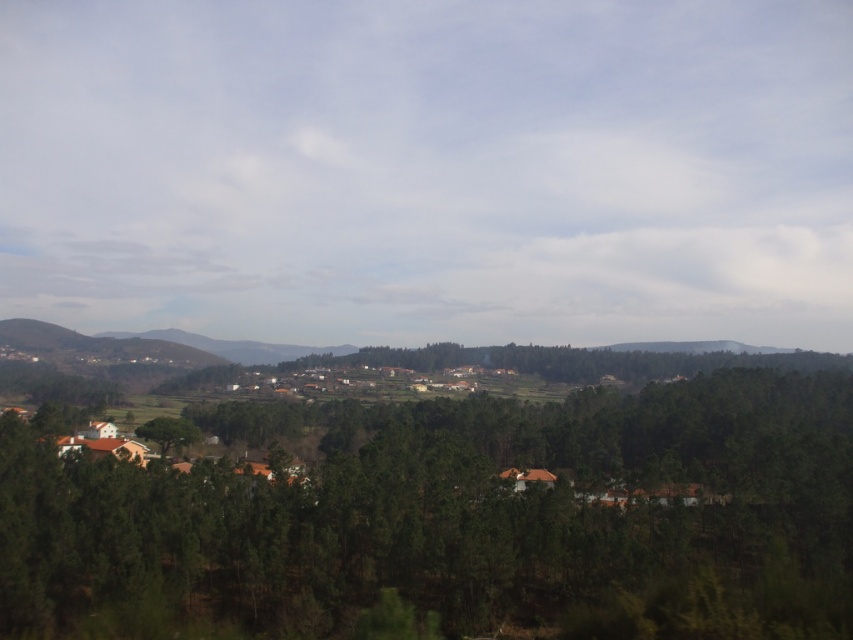
You are an environmental scientist assessing the landscape. You need to determine which object occupies more horizontal space in the scene between the green forested mountain at center and the green matte tree at center. Which one is wider?

The green forested mountain at center is wider than the green matte tree at center, as its width surpasses that of the tree.

You are a hiker standing at the edge of the forest looking at the green matte trees at center and the green forested mountain at center. Which object is closer to you?

The green matte trees at center are closer to you because they are taller in the image compared to the green forested mountain at center, which is farther away.